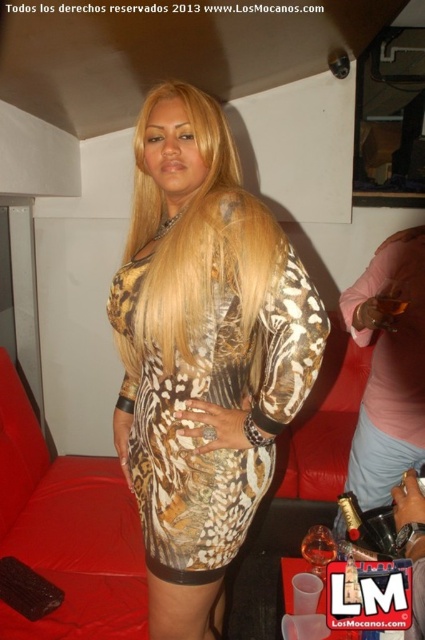
Question: Does blondehair at center have a lesser width compared to metallic gold ring at center?

Choices:
 (A) yes
 (B) no

Answer: (B)

Question: Which point is closer to the camera?

Choices:
 (A) metallic gold ring at center
 (B) metallic gold bracelet at upper right
 (C) leopard print dress at center
 (D) blondehair at center

Answer: (C)

Question: Which of the following is the farthest from the observer?

Choices:
 (A) blondehair at center
 (B) metallic gold bracelet at upper right
 (C) metallic gold ring at center
 (D) leopard print dress at center

Answer: (C)

Question: Is leopard print dress at center wider than blondehair at center?

Choices:
 (A) yes
 (B) no

Answer: (A)

Question: Can you confirm if metallic gold bracelet at upper right is bigger than metallic gold ring at center?

Choices:
 (A) no
 (B) yes

Answer: (B)

Question: Which point is farther from the camera taking this photo?

Choices:
 (A) (376, 467)
 (B) (141, 109)
 (C) (416, 413)

Answer: (A)